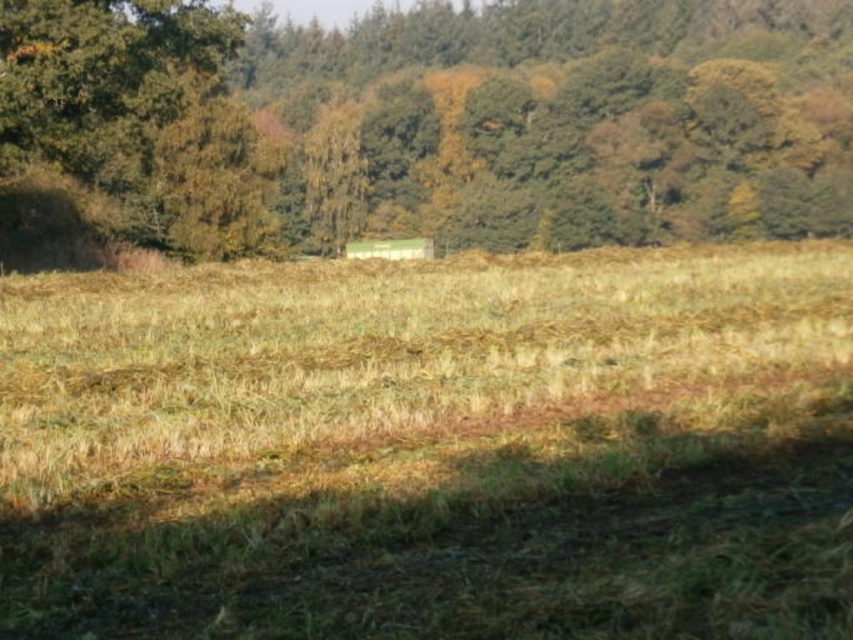
You are standing in the rural landscape scene and want to walk from the point at coordinates point (502, 365) to the point at coordinates point (515, 237). Since you can only move forward in a straight line, will you first encounter the field or the forest?

Point (502, 365) is closer to the viewer than point (515, 237). Since you start at the closer point and move forward, you will first encounter the field before reaching the forest in the background.

You are a farmer checking the field. You notice dry grass at center and a green leafy tree at upper center. Which one is shorter?

The dry grass at center is shorter than the green leafy tree at upper center.